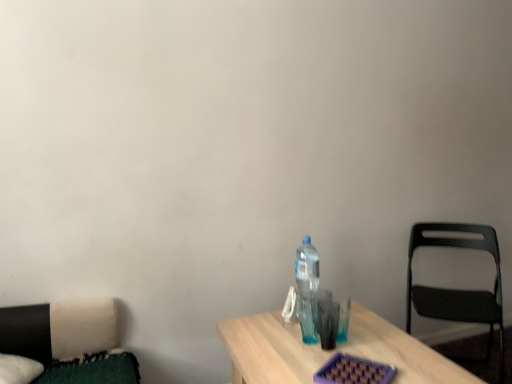
Image resolution: width=512 pixels, height=384 pixels. Describe the element at coordinates (458, 290) in the screenshot. I see `black plastic chair at right` at that location.

What is the approximate width of black plastic chair at right?

black plastic chair at right is 49.45 centimeters in width.

At what (x,y) coordinates should I click in order to perform the action: click on black plastic chair at right. Please return your answer as a coordinate pair (x, y). Looking at the image, I should click on (458, 290).

Find the location of a particular element. The width and height of the screenshot is (512, 384). transparent plastic bottle at center-right is located at coordinates (307, 289).

The image size is (512, 384). Describe the element at coordinates (307, 289) in the screenshot. I see `transparent plastic bottle at center-right` at that location.

This screenshot has height=384, width=512. Find the location of `black plastic chair at right`. black plastic chair at right is located at coordinates (458, 290).

Based on their positions, is transparent plastic bottle at center-right located to the left or right of black plastic chair at right?

Clearly, transparent plastic bottle at center-right is on the left of black plastic chair at right in the image.

Is transparent plastic bottle at center-right further to the viewer compared to black plastic chair at right?

No, it is not.

Is point (315, 265) closer or farther from the camera than point (420, 314)?

Clearly, point (315, 265) is closer to the camera than point (420, 314).

From the image's perspective, is transparent plastic bottle at center-right above black plastic chair at right?

Yes, from the image's perspective, transparent plastic bottle at center-right is on top of black plastic chair at right.

From a real-world perspective, is transparent plastic bottle at center-right physically below black plastic chair at right?

No, from a real-world perspective, transparent plastic bottle at center-right is not beneath black plastic chair at right.

In the scene shown: In terms of width, does transparent plastic bottle at center-right look wider or thinner when compared to black plastic chair at right?

transparent plastic bottle at center-right is thinner than black plastic chair at right.

Who is taller, transparent plastic bottle at center-right or black plastic chair at right?

black plastic chair at right is taller.

Is transparent plastic bottle at center-right bigger than black plastic chair at right?

Incorrect, transparent plastic bottle at center-right is not larger than black plastic chair at right.

Is transparent plastic bottle at center-right positioned beyond the bounds of black plastic chair at right?

Yes, transparent plastic bottle at center-right is outside of black plastic chair at right.

Are transparent plastic bottle at center-right and black plastic chair at right making contact?

No, transparent plastic bottle at center-right is not beside black plastic chair at right.

Is transparent plastic bottle at center-right facing away from black plastic chair at right?

No, black plastic chair at right is not at the back of transparent plastic bottle at center-right.

What are the coordinates of `chair that appears behind the transparent plastic bottle at center-right` in the screenshot? It's located at (458, 290).

Visually, is black plastic chair at right positioned to the left or to the right of transparent plastic bottle at center-right?

In the image, black plastic chair at right appears on the right side of transparent plastic bottle at center-right.

Which object is further away from the camera taking this photo, black plastic chair at right or transparent plastic bottle at center-right?

Positioned behind is black plastic chair at right.

Considering the points (495, 304) and (308, 317), which point is behind, point (495, 304) or point (308, 317)?

The point (495, 304) is more distant.

From the image's perspective, is black plastic chair at right over transparent plastic bottle at center-right?

No.

From a real-world perspective, which is physically below, black plastic chair at right or transparent plastic bottle at center-right?

From a 3D spatial view, black plastic chair at right is below.

Is black plastic chair at right wider or thinner than transparent plastic bottle at center-right?

Clearly, black plastic chair at right has more width compared to transparent plastic bottle at center-right.

From their relative heights in the image, would you say black plastic chair at right is taller or shorter than transparent plastic bottle at center-right?

Clearly, black plastic chair at right is taller compared to transparent plastic bottle at center-right.

Between black plastic chair at right and transparent plastic bottle at center-right, which one has smaller size?

Smaller between the two is transparent plastic bottle at center-right.

From the picture: Can we say black plastic chair at right lies outside transparent plastic bottle at center-right?

That's correct, black plastic chair at right is outside of transparent plastic bottle at center-right.

In the scene shown: Is black plastic chair at right far from transparent plastic bottle at center-right?

black plastic chair at right is positioned a significant distance from transparent plastic bottle at center-right.

Could you tell me if black plastic chair at right is facing transparent plastic bottle at center-right?

No, black plastic chair at right is not turned towards transparent plastic bottle at center-right.

The width and height of the screenshot is (512, 384). I want to click on chair below the transparent plastic bottle at center-right (from a real-world perspective), so click(x=458, y=290).

Where is `chair on the right of transparent plastic bottle at center-right`? Image resolution: width=512 pixels, height=384 pixels. chair on the right of transparent plastic bottle at center-right is located at coordinates (458, 290).

This screenshot has width=512, height=384. In order to click on bottle on the left side of black plastic chair at right in this screenshot , I will do `click(307, 289)`.